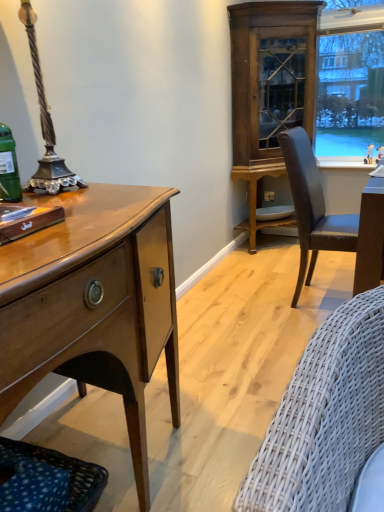
The height and width of the screenshot is (512, 384). I want to click on vacant region to the left of leather-like chair at right, so click(247, 318).